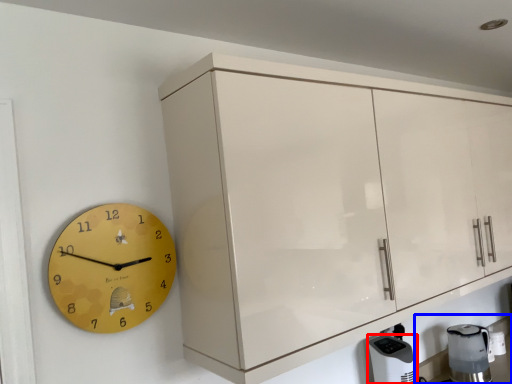
Question: Among these objects, which one is nearest to the camera, appliance (highlighted by a red box) or counter top (highlighted by a blue box)?

Choices:
 (A) appliance
 (B) counter top

Answer: (A)